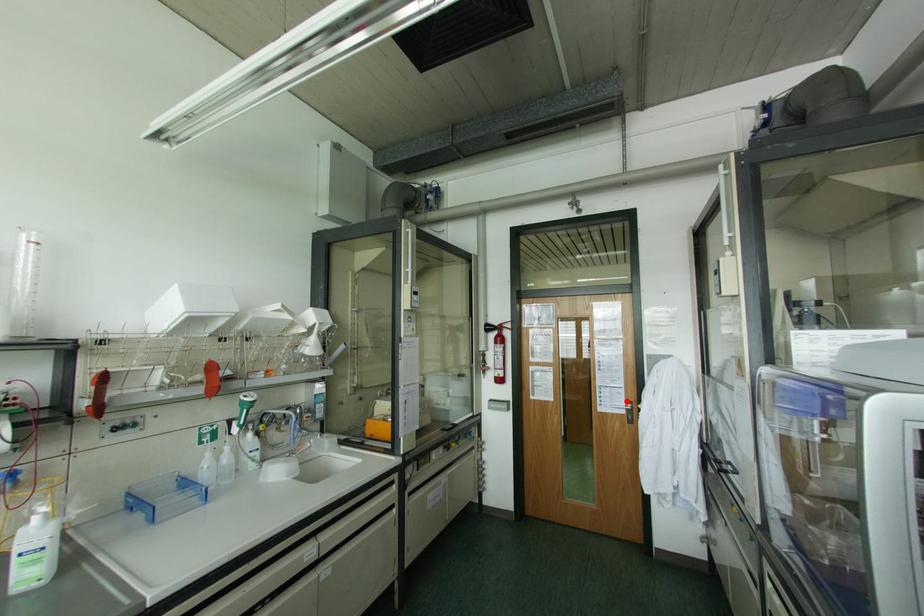
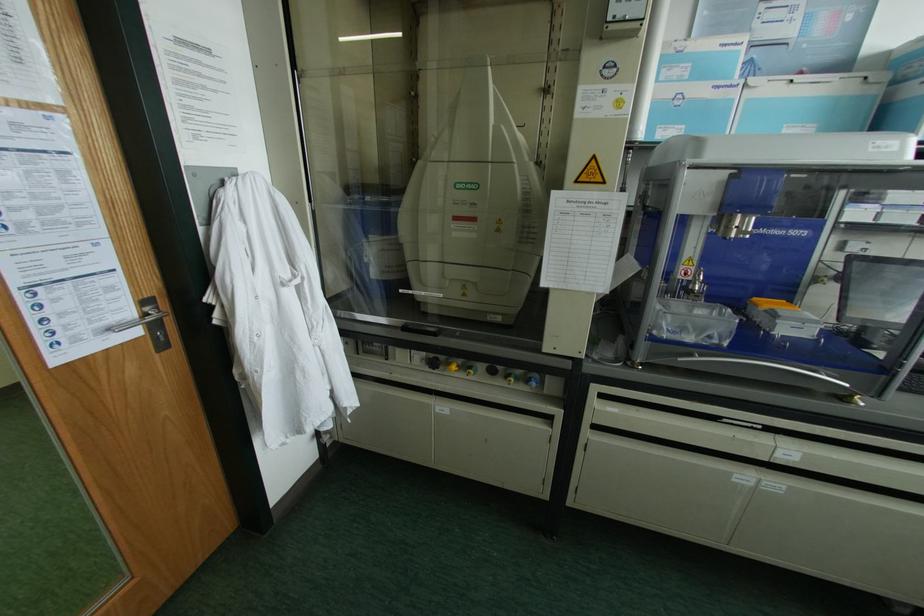
Where in the second image is the point corresponding to the highlighted location from the first image?

(142, 302)